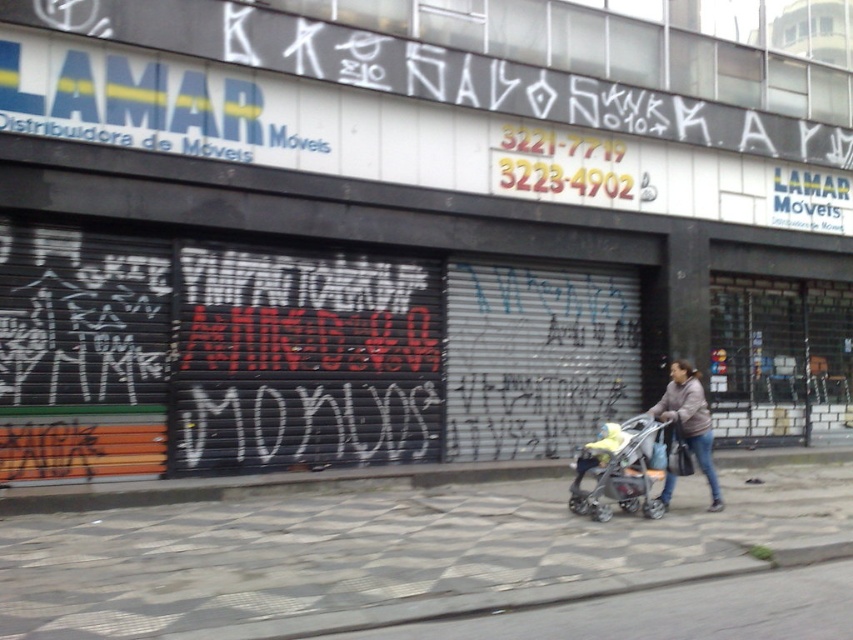
Question: Is checkerboard tile pavement at center further to camera compared to brown fuzzy jacket at lower right?

Choices:
 (A) yes
 (B) no

Answer: (B)

Question: Does gray fabric stroller at center lie behind yellow fabric baby carriage at center?

Choices:
 (A) no
 (B) yes

Answer: (A)

Question: Estimate the real-world distances between objects in this image. Which object is farther from the gray fabric stroller at center?

Choices:
 (A) checkerboard tile pavement at center
 (B) brown fuzzy jacket at lower right
 (C) yellow fabric baby carriage at center

Answer: (A)

Question: Is gray fabric stroller at center above yellow fabric baby carriage at center?

Choices:
 (A) yes
 (B) no

Answer: (B)

Question: Which is farther from the yellow fabric baby carriage at center?

Choices:
 (A) gray fabric stroller at center
 (B) checkerboard tile pavement at center

Answer: (B)

Question: Which point is farther to the camera?

Choices:
 (A) (593, 451)
 (B) (0, 568)
 (C) (698, 456)

Answer: (C)